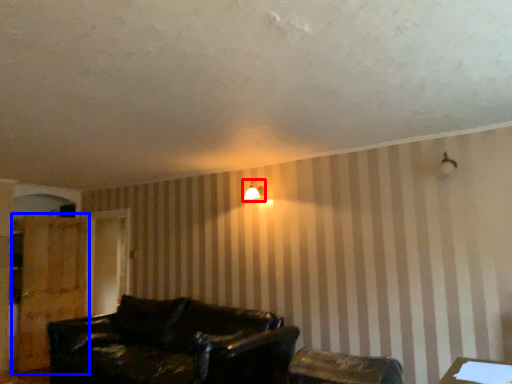
Question: Which point is further to the camera, lamp (highlighted by a red box) or dresser (highlighted by a blue box)?

Choices:
 (A) lamp
 (B) dresser

Answer: (B)